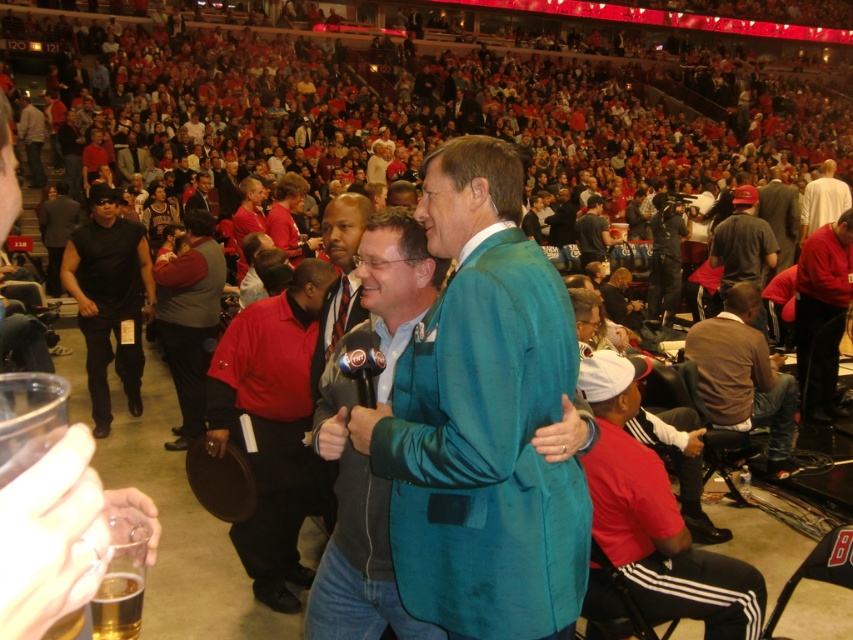
You are a photographer at the event and need to capture a photo of both the red cotton shirt at lower right and the red fleece jacket at right. Which object should you zoom in on to ensure both are fully visible in the frame?

The red cotton shirt at lower right is wider than the red fleece jacket at right, so you should zoom in on the red cotton shirt at lower right to ensure both are fully visible in the frame.

You are a photographer at the event and want to take a photo of both the red cotton shirt at lower right and the red fleece jacket at right. Which one should you focus on first to ensure both are in sharp focus?

You should focus on the red cotton shirt at lower right first because it is closer to the viewer than the red fleece jacket at right. By focusing on the closer object, the farther one will also be in focus due to the depth of field.

You are a photographer at the event and want to take a photo of both the red cotton shirt at lower right and the red fleece jacket at right. Which object should you position closer to the left side of the frame to include both in the photo?

You should position the red cotton shirt at lower right closer to the left side of the frame because it is already to the left of the red fleece jacket at right.